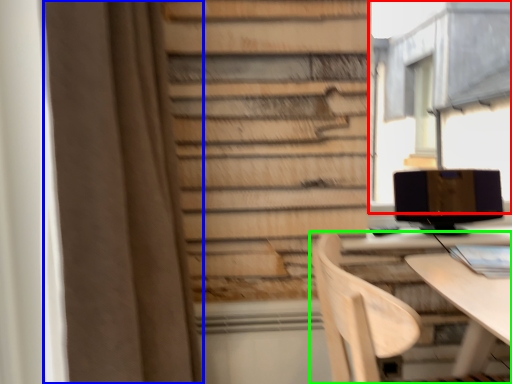
Question: Considering the real-world distances, which object is farthest from bay window (highlighted by a red box)? curtain (highlighted by a blue box) or chair (highlighted by a green box)?

Choices:
 (A) curtain
 (B) chair

Answer: (B)